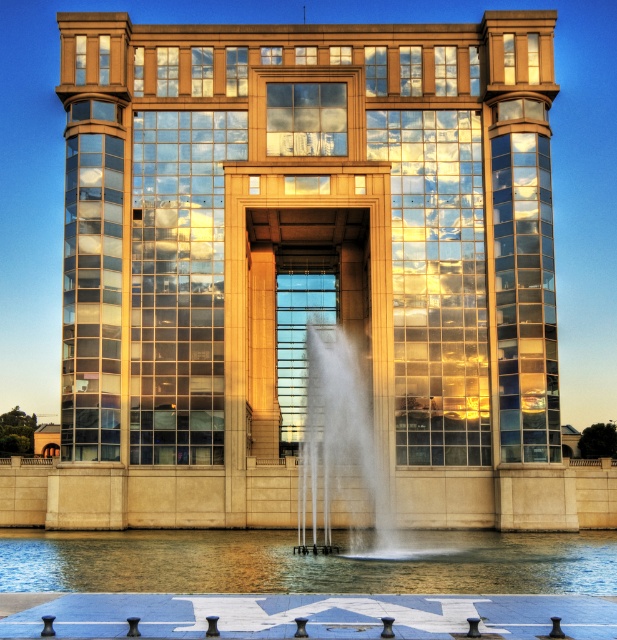
Between clear glass water at lower center and white frothy water at center, which one appears on the left side from the viewer's perspective?

white frothy water at center is more to the left.

The width and height of the screenshot is (617, 640). Find the location of `clear glass water at lower center`. clear glass water at lower center is located at coordinates (305, 563).